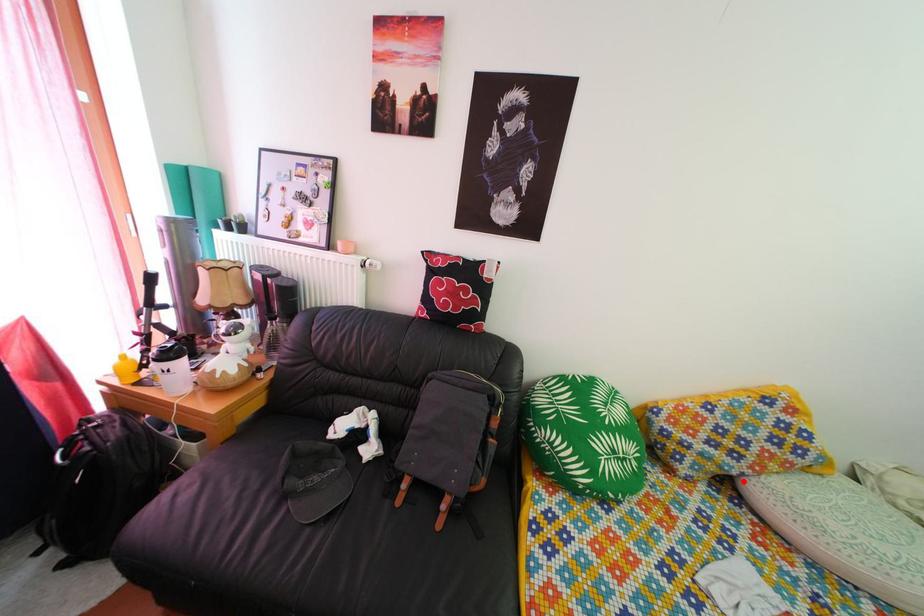
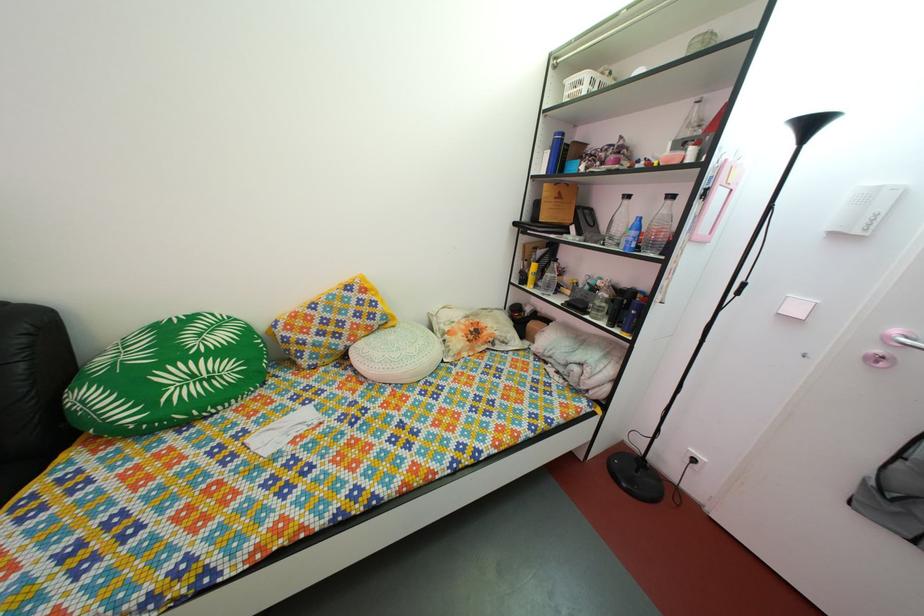
In the second image, find the point that corresponds to the highlighted location in the first image.

(349, 357)